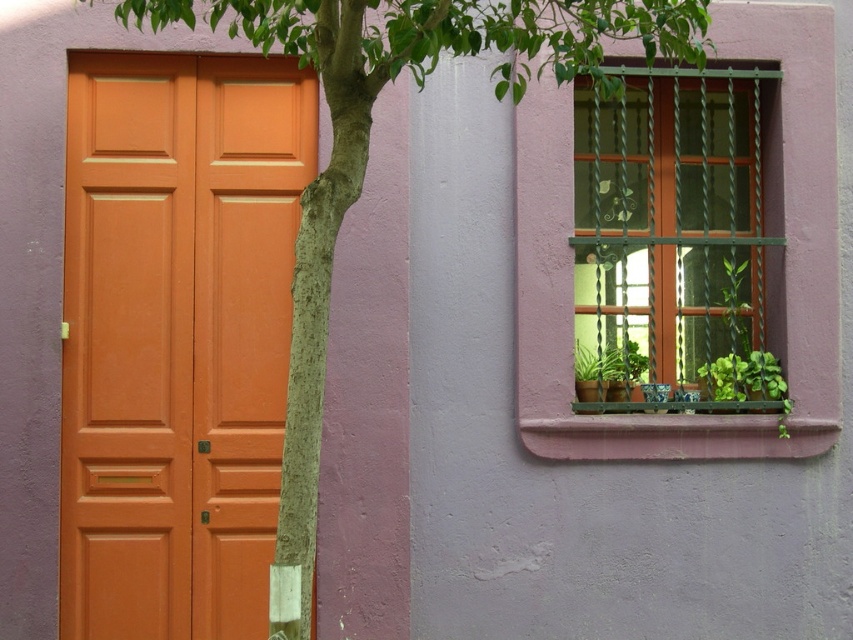
Question: Is matte orange door at left above green metal bars at upper right?

Choices:
 (A) no
 (B) yes

Answer: (A)

Question: Observing the image, what is the correct spatial positioning of matte orange door at left in reference to green metal bars at upper right?

Choices:
 (A) left
 (B) right

Answer: (A)

Question: Which point is closer to the camera?

Choices:
 (A) matte orange door at left
 (B) green metal bars at upper right

Answer: (A)

Question: Does matte orange door at left appear on the right side of green metal bars at upper right?

Choices:
 (A) yes
 (B) no

Answer: (B)

Question: Which point appears farthest from the camera in this image?

Choices:
 (A) (660, 333)
 (B) (200, 144)

Answer: (A)